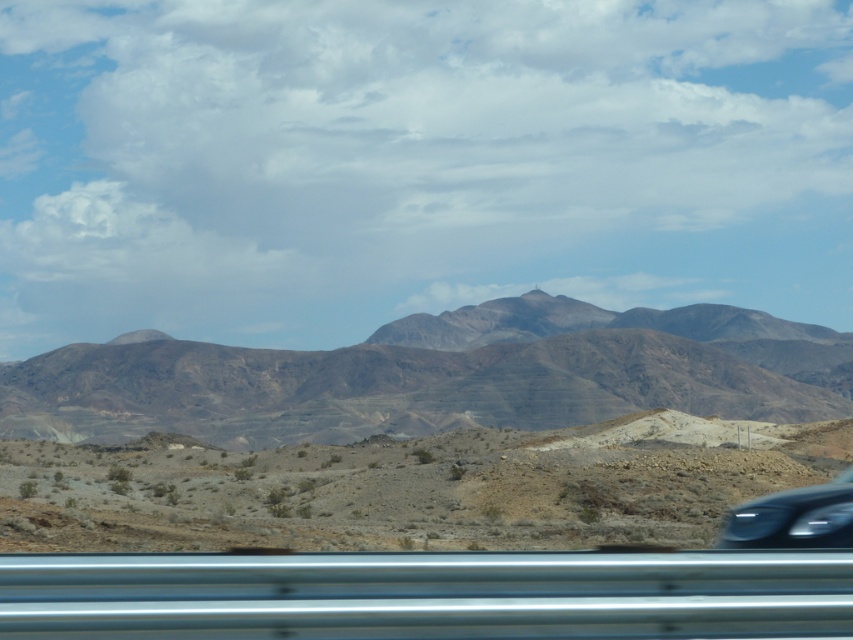
Is desert at center to the right of metallic silver car window at bottom from the viewer's perspective?

Incorrect, desert at center is not on the right side of metallic silver car window at bottom.

Looking at this image, who is higher up, desert at center or metallic silver car window at bottom?

Positioned higher is metallic silver car window at bottom.

This screenshot has height=640, width=853. In order to click on desert at center in this screenshot , I will do `click(410, 486)`.

Locate an element on the screen. desert at center is located at coordinates (410, 486).

The height and width of the screenshot is (640, 853). Describe the element at coordinates (438, 376) in the screenshot. I see `brown rocky mountain range at center` at that location.

Find the location of a particular element. The height and width of the screenshot is (640, 853). brown rocky mountain range at center is located at coordinates (438, 376).

Which is more to the right, metallic silver car window at bottom or sleek black car at lower right?

sleek black car at lower right is more to the right.

What do you see at coordinates (428, 595) in the screenshot? The height and width of the screenshot is (640, 853). I see `metallic silver car window at bottom` at bounding box center [428, 595].

Image resolution: width=853 pixels, height=640 pixels. I want to click on metallic silver car window at bottom, so click(x=428, y=595).

Locate an element on the screen. The image size is (853, 640). metallic silver car window at bottom is located at coordinates (428, 595).